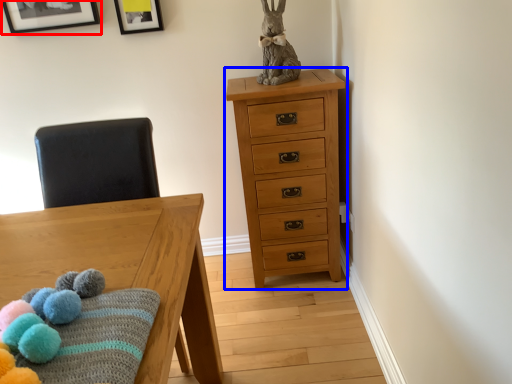
Question: Which point is closer to the camera, picture frame (highlighted by a red box) or chest of drawers (highlighted by a blue box)?

Choices:
 (A) picture frame
 (B) chest of drawers

Answer: (B)